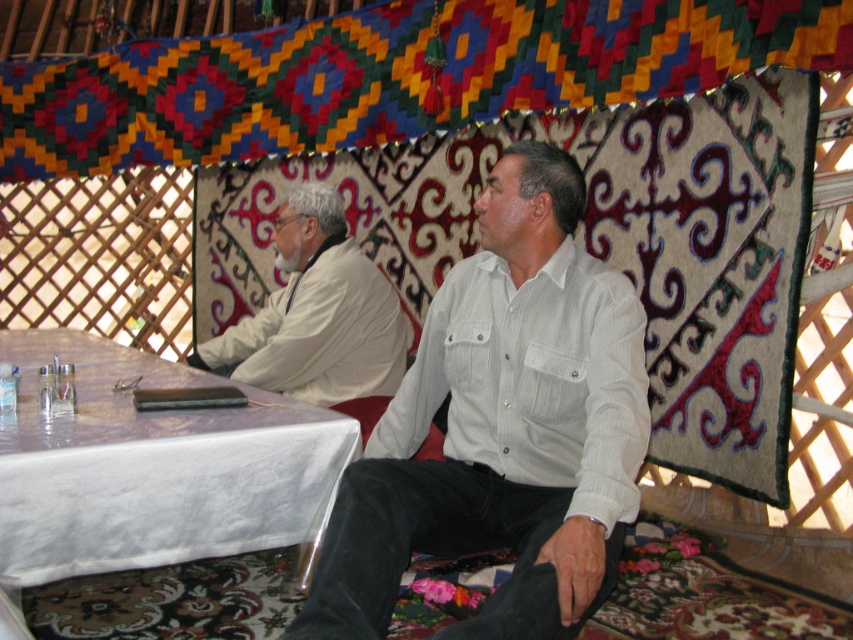
Does point (502, 369) come farther from viewer compared to point (291, 269)?

No, (502, 369) is in front of (291, 269).

Can you confirm if white striped shirt at center is positioned above white matte shirt at upper left?

No.

Locate an element on the screen. white striped shirt at center is located at coordinates (502, 428).

Image resolution: width=853 pixels, height=640 pixels. I want to click on white striped shirt at center, so pos(502,428).

Is white cloth table at lower left positioned before white matte shirt at upper left?

Yes, it is in front of white matte shirt at upper left.

Identify the location of white cloth table at lower left. (154, 467).

I want to click on white cloth table at lower left, so [154, 467].

Between white striped shirt at center and white cloth table at lower left, which one appears on the right side from the viewer's perspective?

white striped shirt at center

Is white striped shirt at center below white cloth table at lower left?

Actually, white striped shirt at center is above white cloth table at lower left.

Is point (416, 499) positioned before point (56, 484)?

No.

Where is `white striped shirt at center`? white striped shirt at center is located at coordinates (502, 428).